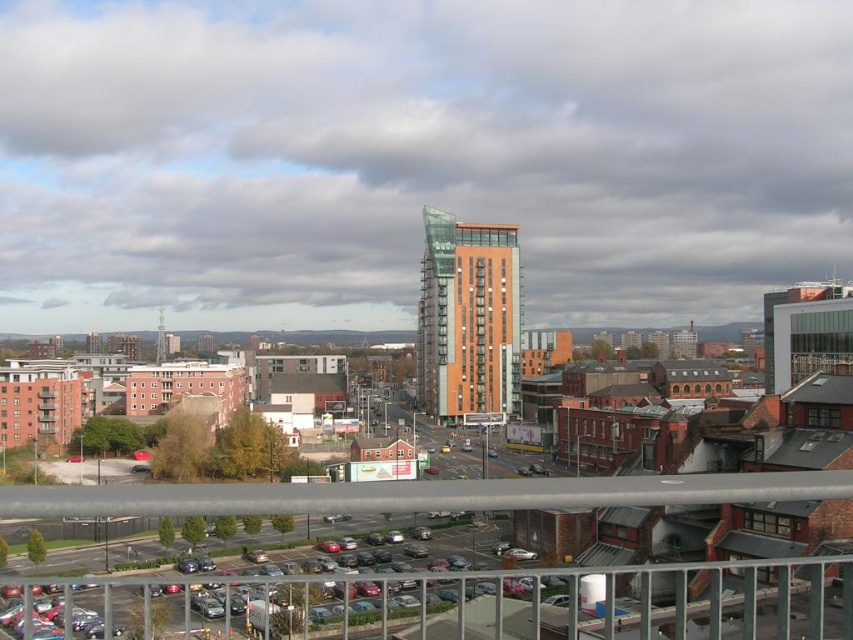
Question: Is gray metallic rail at lower center thinner than metal at center?

Choices:
 (A) yes
 (B) no

Answer: (A)

Question: Is gray metallic rail at lower center above metal at center?

Choices:
 (A) yes
 (B) no

Answer: (A)

Question: Among these objects, which one is nearest to the camera?

Choices:
 (A) gray metallic rail at lower center
 (B) metal at center

Answer: (B)

Question: Is gray metallic rail at lower center below metal at center?

Choices:
 (A) yes
 (B) no

Answer: (B)